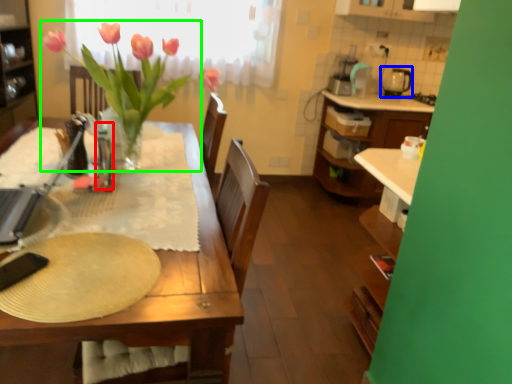
Question: Considering the real-world distances, which object is closest to bottle (highlighted by a red box)? appliance (highlighted by a blue box) or houseplant (highlighted by a green box).

Choices:
 (A) appliance
 (B) houseplant

Answer: (B)